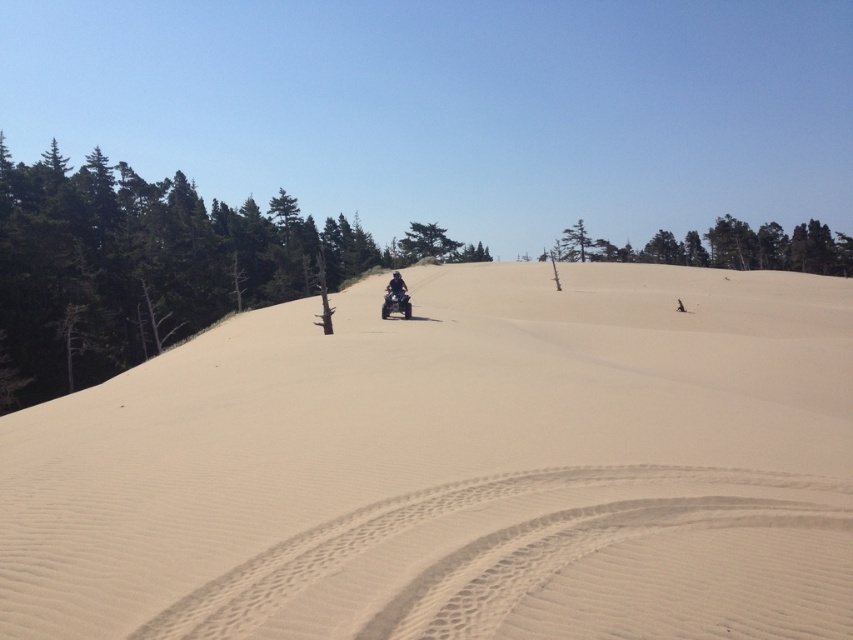
You are planning to take a photo of the green textured tree at upper center and the green textured tree at center from the top of the dune. Which tree should you focus on first if you want to capture the largest tree in the frame?

The green textured tree at upper center is larger in size than the green textured tree at center, so you should focus on the green textured tree at upper center first to capture the largest tree in the frame.